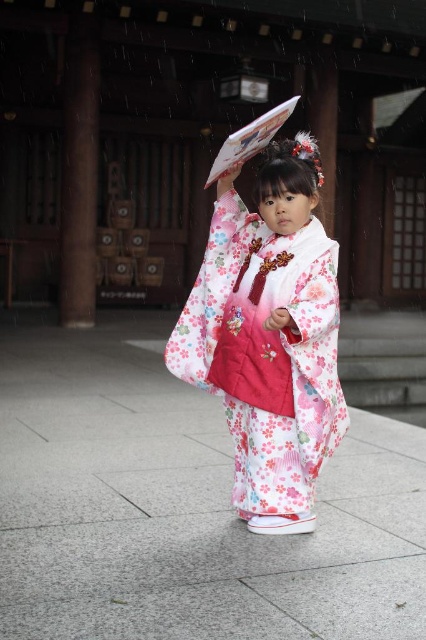
Question: Does gray concrete pavement at center have a smaller size compared to floral silk kimono at center?

Choices:
 (A) yes
 (B) no

Answer: (B)

Question: Can you confirm if gray concrete pavement at center is bigger than floral silk kimono at center?

Choices:
 (A) yes
 (B) no

Answer: (A)

Question: Is gray concrete pavement at center smaller than floral silk kimono at center?

Choices:
 (A) no
 (B) yes

Answer: (A)

Question: Which point appears farthest from the camera in this image?

Choices:
 (A) (x=310, y=484)
 (B) (x=184, y=636)

Answer: (A)

Question: Which point is closer to the camera?

Choices:
 (A) floral silk kimono at center
 (B) gray concrete pavement at center

Answer: (B)